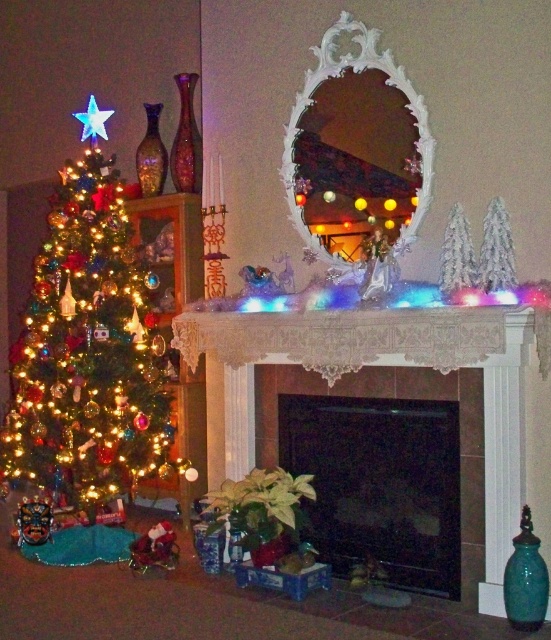
You are a delivery person holding a large box that is 1.5 meters wide. You need to navigate through the living room to place the box near the Christmas tree. Is there enough space between the shiny multicolored ornaments at left and the white ornate mirror at center to move the box through?

The distance between the shiny multicolored ornaments at left and the white ornate mirror at center is 1.33 meters. Since the box is 1.5 meters wide, it is wider than the available space. Therefore, the box cannot be moved through that path.

You are standing in the living room and want to place a small gift between the two points, point (x=348, y=349) and point (x=371, y=412). Which point should the gift be closer to in order to be in front of the other point?

The gift should be closer to point (x=348, y=349) because it is in front of point (x=371, y=412).